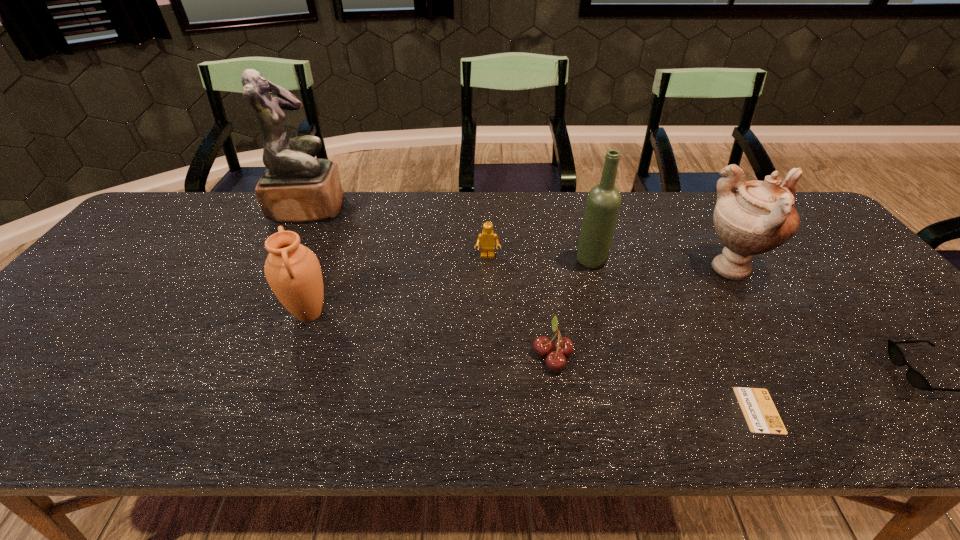
The image size is (960, 540). I want to click on identity card, so click(761, 415).

You are a GUI agent. You are given a task and a screenshot of the screen. Output one action in this format:
    pyautogui.click(x=<x>, y=<y>)
    Task: Click on the vacant space located in a relaxed pose on the sculpture
    
    Given the screenshot: What is the action you would take?
    pyautogui.click(x=371, y=207)

Locate an element on the screen. The image size is (960, 540). free space located on the front of the fifth object from left to right is located at coordinates (607, 319).

Where is `free space located on the back of the taller urn`? Image resolution: width=960 pixels, height=540 pixels. free space located on the back of the taller urn is located at coordinates (696, 212).

At what (x,y) coordinates should I click in order to perform the action: click on vacant space located 0.180m on the back of the left urn. Please return your answer as a coordinate pair (x, y). Looking at the image, I should click on (333, 251).

Locate an element on the screen. This screenshot has height=540, width=960. free space located on the face of the Lego is located at coordinates (488, 275).

The height and width of the screenshot is (540, 960). What are the coordinates of `free region located on the leaves of the fifth object from right to left` in the screenshot? It's located at 501,355.

Locate an element on the screen. free space located 0.200m on the leaves of the fifth object from right to left is located at coordinates (444, 355).

Find the location of `vacant space positioned on the leaves of the fifth object from right to left`. vacant space positioned on the leaves of the fifth object from right to left is located at coordinates click(452, 355).

This screenshot has width=960, height=540. Identify the location of vacant point located 0.120m on the left of the shortest object. (681, 410).